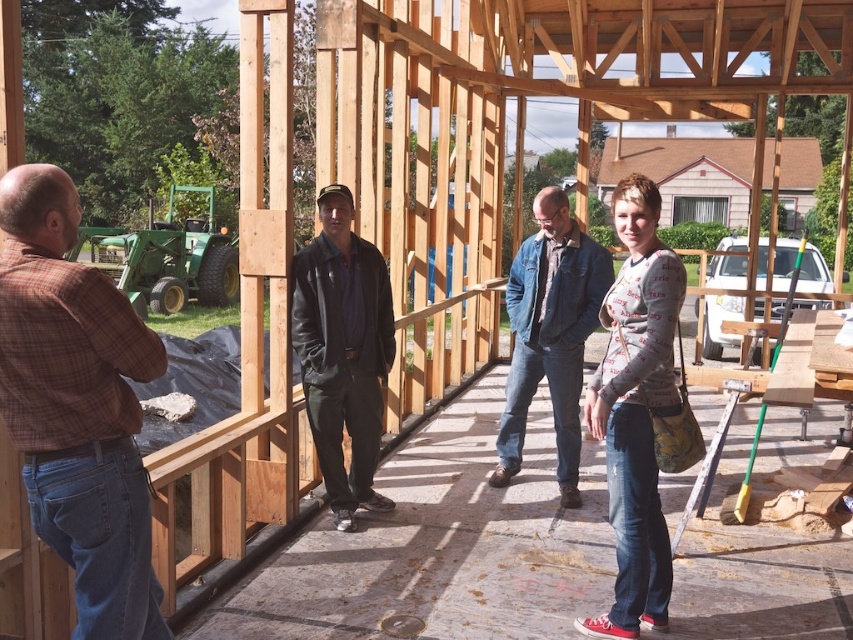
Can you confirm if plaid shirt at left is shorter than denim jacket at center?

Yes, plaid shirt at left is shorter than denim jacket at center.

The width and height of the screenshot is (853, 640). What do you see at coordinates (77, 406) in the screenshot?
I see `plaid shirt at left` at bounding box center [77, 406].

Is point (10, 419) positioned behind point (532, 289)?

No, (10, 419) is closer to viewer.

The width and height of the screenshot is (853, 640). In order to click on plaid shirt at left in this screenshot , I will do `click(77, 406)`.

Is dark blue leather jacket at center closer to the viewer compared to denim jacket at center?

No, it is not.

Is point (345, 364) in front of point (534, 364)?

That is True.

At what (x,y) coordinates should I click in order to perform the action: click on dark blue leather jacket at center. Please return your answer as a coordinate pair (x, y). Looking at the image, I should click on (341, 352).

Is plaid shirt at left smaller than dark blue leather jacket at center?

Indeed, plaid shirt at left has a smaller size compared to dark blue leather jacket at center.

At what (x,y) coordinates should I click in order to perform the action: click on plaid shirt at left. Please return your answer as a coordinate pair (x, y). Looking at the image, I should click on (77, 406).

You are a GUI agent. You are given a task and a screenshot of the screen. Output one action in this format:
    pyautogui.click(x=<x>, y=<y>)
    Task: Click on the plaid shirt at left
    
    Given the screenshot: What is the action you would take?
    pyautogui.click(x=77, y=406)